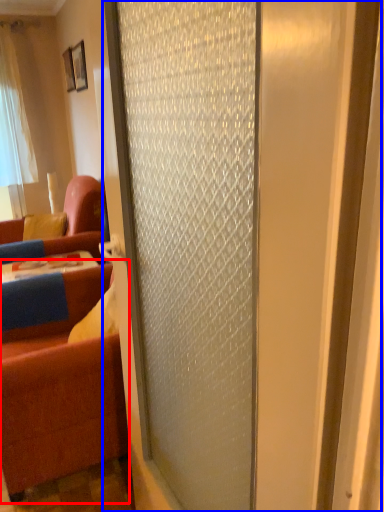
Question: Which point is closer to the camera, studio couch (highlighted by a red box) or door (highlighted by a blue box)?

Choices:
 (A) studio couch
 (B) door

Answer: (B)